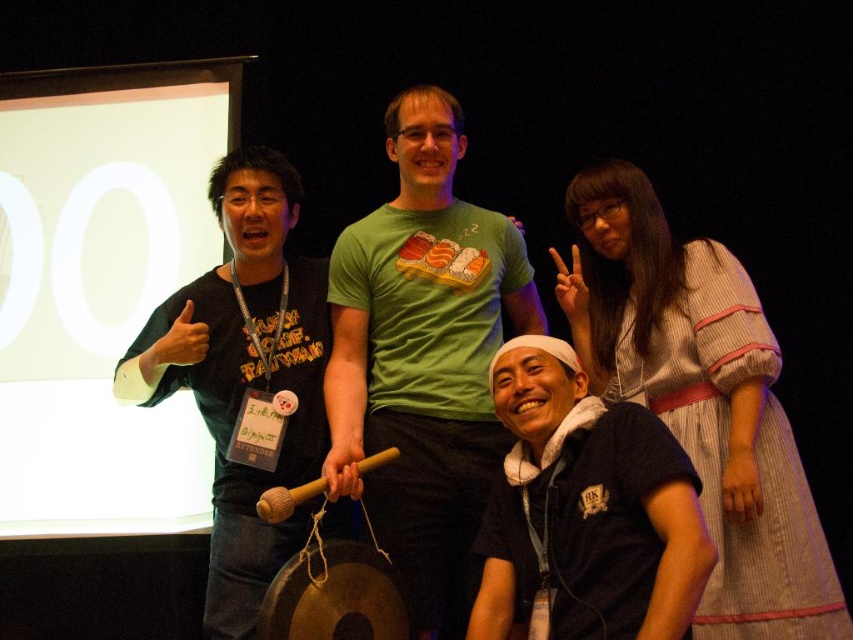
You are a photographer trying to capture a closeup of the dark blue fabric at lower right and the black matte shirt at left. Which one is positioned lower in the image?

The dark blue fabric at lower right is positioned lower than the black matte shirt at left.